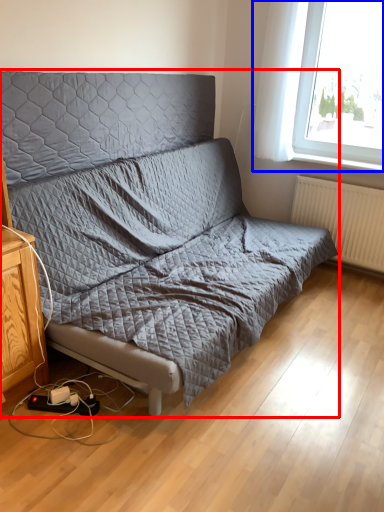
Question: Which object is closer to the camera taking this photo, studio couch (highlighted by a red box) or window (highlighted by a blue box)?

Choices:
 (A) studio couch
 (B) window

Answer: (A)